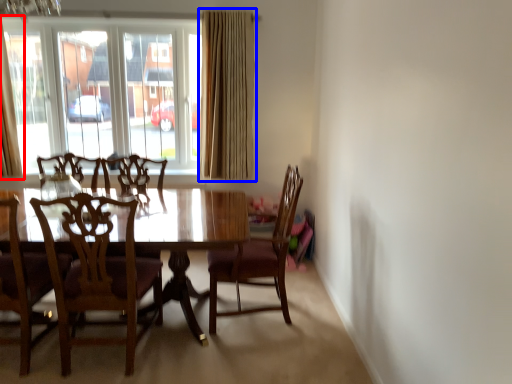
Question: Which of the following is the farthest to the observer, curtain (highlighted by a red box) or curtain (highlighted by a blue box)?

Choices:
 (A) curtain
 (B) curtain

Answer: (B)